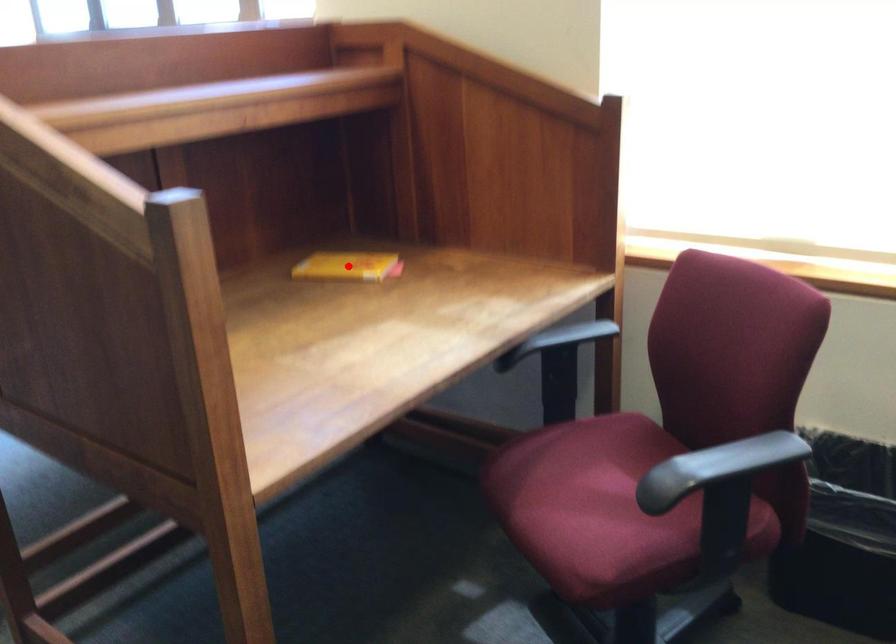
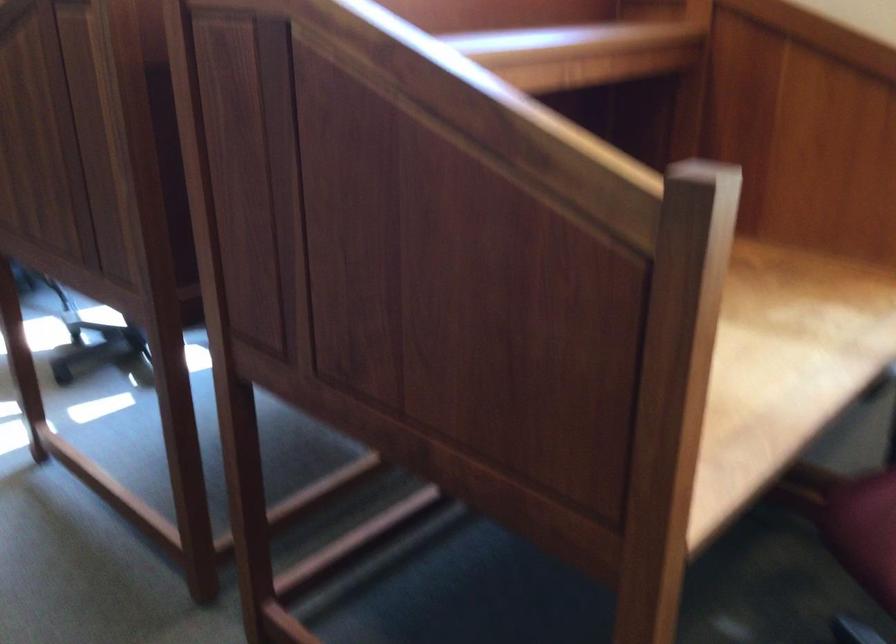
Question: I am providing you with two images of the same scene from different viewpoints. A red point is marked on the first image. At the location where the point appears in image 1, is it still visible in image 2?

Choices:
 (A) Yes
 (B) No

Answer: (B)